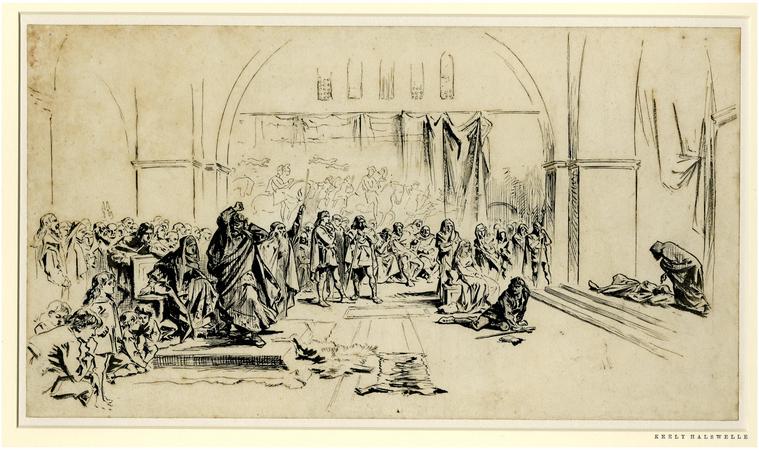
Image resolution: width=759 pixels, height=450 pixels. I want to click on robe, so click(231, 272).